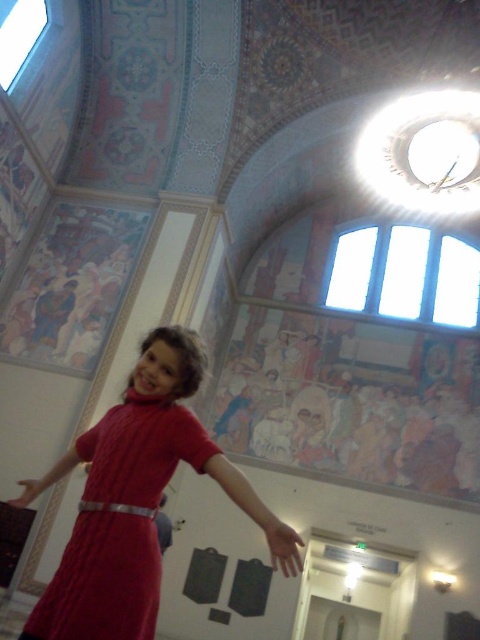
You are standing in the center of the room and see a point marked at coordinates (162, 444). What object is this point located on?

The point is located on the cable knit dress at center.